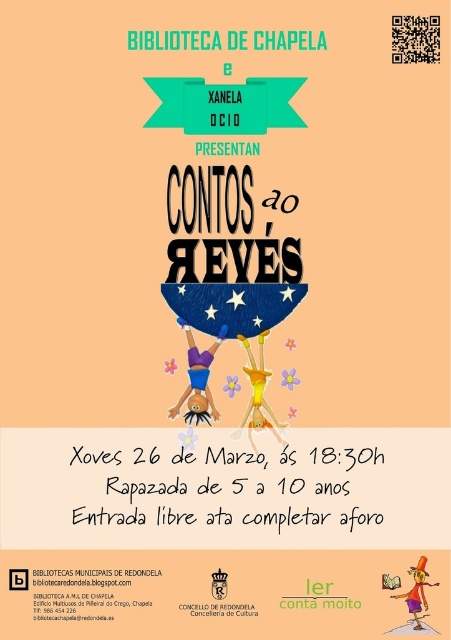
Can you confirm if black paper at lower left is positioned to the left of black paper text at center?

Yes, black paper at lower left is to the left of black paper text at center.

Describe the element at coordinates (83, 593) in the screenshot. The height and width of the screenshot is (640, 451). I see `black paper at lower left` at that location.

Where is `black paper at lower left`? The image size is (451, 640). black paper at lower left is located at coordinates (83, 593).

Is point (197, 35) closer to viewer compared to point (303, 604)?

No, it is not.

Who is lower down, greentextured ribbonbanner at upper center or blacktexturedtext at center?

blacktexturedtext at center

Between point (207, 42) and point (358, 604), which one is positioned in front?

Point (358, 604) is in front.

Where is `greentextured ribbonbanner at upper center`? The width and height of the screenshot is (451, 640). greentextured ribbonbanner at upper center is located at coordinates (171, 38).

The height and width of the screenshot is (640, 451). I want to click on blacktexturedtext at center, so click(317, 596).

Looking at this image, is blacktexturedtext at center taller than redpapertext at center?

Yes, blacktexturedtext at center is taller than redpapertext at center.

Locate an element on the screen. blacktexturedtext at center is located at coordinates (317, 596).

Where is `blacktexturedtext at center`? The width and height of the screenshot is (451, 640). blacktexturedtext at center is located at coordinates (317, 596).